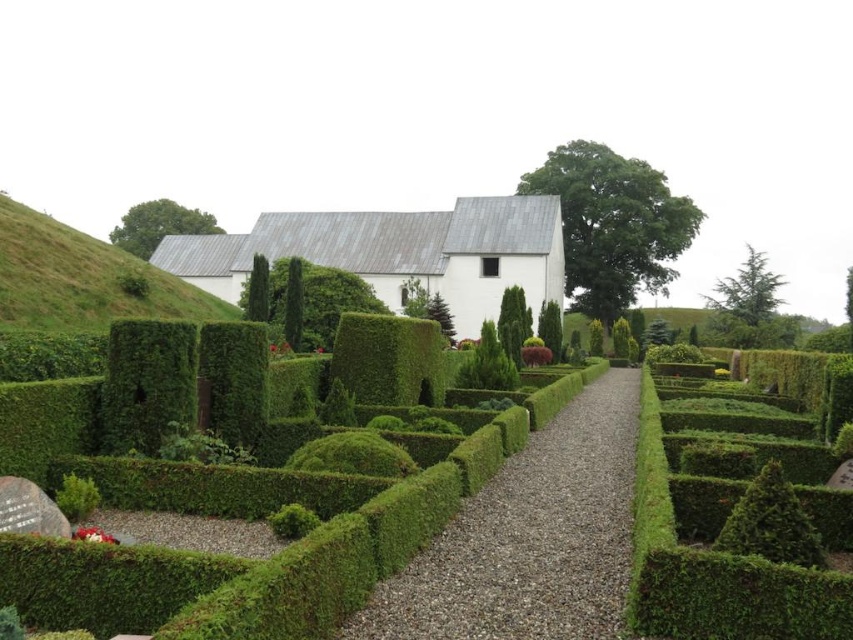
Question: Does green leafy bush at center have a greater width compared to green leafy bush at upper left?

Choices:
 (A) yes
 (B) no

Answer: (B)

Question: Which object is closer to the camera taking this photo?

Choices:
 (A) green leafy bush at upper left
 (B) green leafy hedge at center right
 (C) green grassy hillside at upper left
 (D) green leafy bush at lower right

Answer: (B)

Question: Can you confirm if green grassy hillside at upper left is bigger than green leafy bush at center?

Choices:
 (A) yes
 (B) no

Answer: (A)

Question: Which object is positioned closest to the green leafy bush at lower right?

Choices:
 (A) gravel path at center
 (B) green leafy bush at upper left
 (C) green grassy hillside at upper left
 (D) green leafy hedge at center right

Answer: (D)

Question: Where is gravel path at center located in relation to green leafy bush at center in the image?

Choices:
 (A) below
 (B) above

Answer: (A)

Question: Which of these objects is positioned farthest from the gravel path at center?

Choices:
 (A) green leafy hedge at center right
 (B) green leafy bush at upper left

Answer: (B)